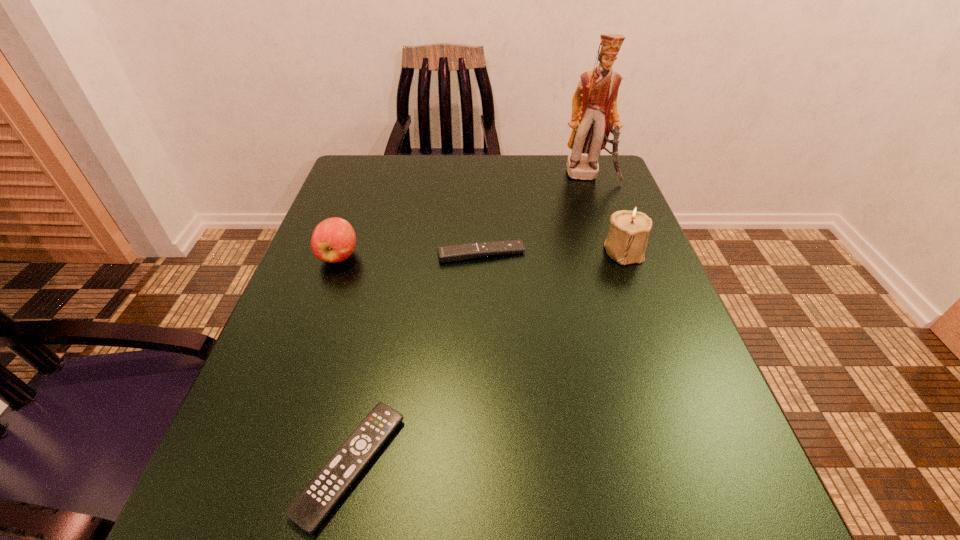
You are a GUI agent. You are given a task and a screenshot of the screen. Output one action in this format:
    pyautogui.click(x=<x>, y=<y>)
    Task: Click on the free area in between the nearer remote control and the tallest object
    The width and height of the screenshot is (960, 540).
    Given the screenshot: What is the action you would take?
    pyautogui.click(x=470, y=320)

Locate an element on the screen. The image size is (960, 540). free point between the second tallest object and the third object from right to left is located at coordinates (552, 252).

Locate an element on the screen. Image resolution: width=960 pixels, height=540 pixels. vacant area that lies between the nearest object and the third shortest object is located at coordinates (345, 361).

This screenshot has height=540, width=960. In order to click on empty space that is in between the farthest object and the nearest object in this screenshot , I will do `click(470, 320)`.

Locate an element on the screen. The image size is (960, 540). free space between the farther remote control and the nutcracker is located at coordinates (536, 214).

Select which object is the fourth closest to the right remote control. Please provide its 2D coordinates. Your answer should be formatted as a tuple, i.e. [(x, y)], where the tuple contains the x and y coordinates of a point satisfying the conditions above.

[(309, 509)]

Identify which object is located as the third nearest to the tallest object. Please provide its 2D coordinates. Your answer should be formatted as a tuple, i.e. [(x, y)], where the tuple contains the x and y coordinates of a point satisfying the conditions above.

[(333, 240)]

In order to click on free space that satisfies the following two spatial constraints: 1. on the front-facing side of the second tallest object; 2. on the right side of the tallest object in this screenshot , I will do `click(616, 251)`.

Identify the location of free point that satisfies the following two spatial constraints: 1. on the front-facing side of the farthest object; 2. on the right side of the fourth shortest object. Image resolution: width=960 pixels, height=540 pixels. (616, 251).